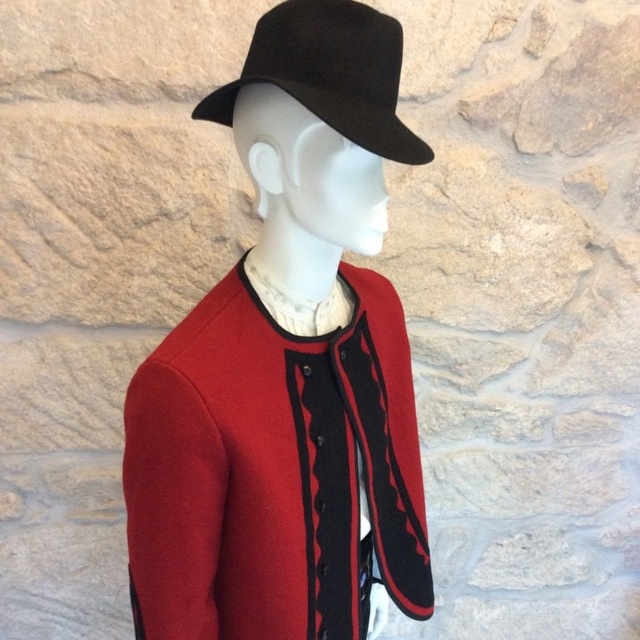
Question: Does matte black hat at center come behind black felt fedora at upper center?

Choices:
 (A) no
 (B) yes

Answer: (B)

Question: Which point is closer to the camera?

Choices:
 (A) (348, 237)
 (B) (364, 19)

Answer: (B)

Question: Is matte black hat at center to the left of black felt fedora at upper center from the viewer's perspective?

Choices:
 (A) no
 (B) yes

Answer: (B)

Question: Which of the following is the closest to the observer?

Choices:
 (A) black felt fedora at upper center
 (B) matte black hat at center

Answer: (A)

Question: Is matte black hat at center further to camera compared to black felt fedora at upper center?

Choices:
 (A) yes
 (B) no

Answer: (A)

Question: Which point appears closest to the camera in this image?

Choices:
 (A) (403, 154)
 (B) (248, 353)

Answer: (A)